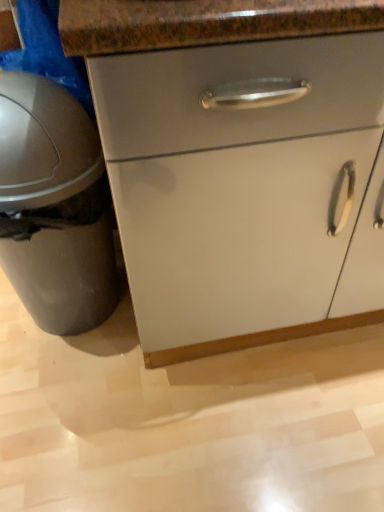
This screenshot has height=512, width=384. I want to click on vacant space in front of gray matte trash can at left, so click(x=75, y=413).